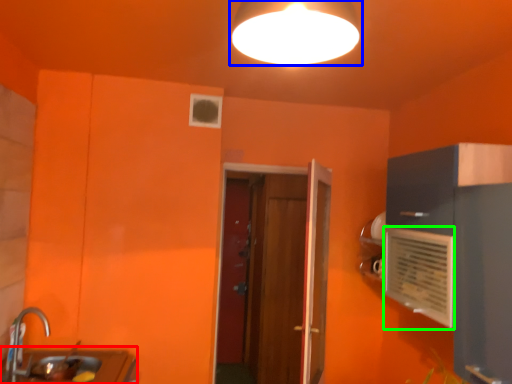
Question: Estimate the real-world distances between objects in this image. Which object is farther from counter top (highlighted by a red box), lamp (highlighted by a blue box) or air conditioning (highlighted by a green box)?

Choices:
 (A) lamp
 (B) air conditioning

Answer: (A)